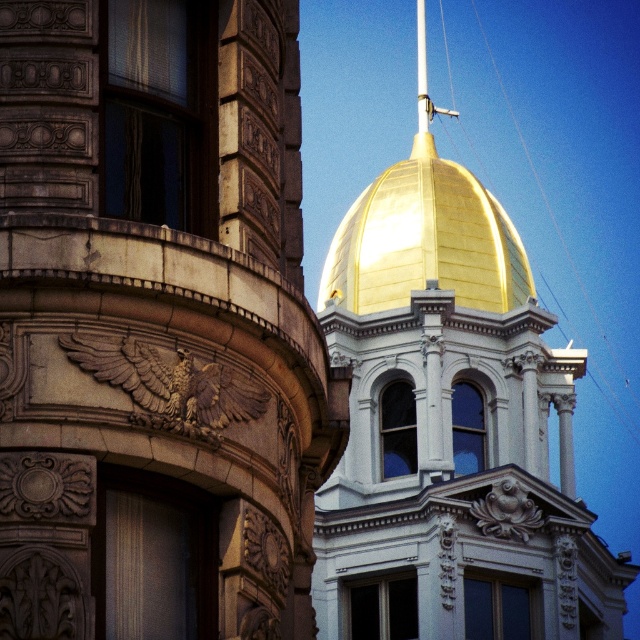
Question: Is gold polished dome at upper center below metallic pole at center?

Choices:
 (A) no
 (B) yes

Answer: (B)

Question: Among these objects, which one is farthest from the camera?

Choices:
 (A) gold polished dome at upper center
 (B) metallic pole at center

Answer: (B)

Question: Which of the following is the closest to the observer?

Choices:
 (A) (422, 6)
 (B) (531, 285)

Answer: (B)

Question: Considering the relative positions of gold polished dome at upper center and metallic pole at center in the image provided, where is gold polished dome at upper center located with respect to metallic pole at center?

Choices:
 (A) above
 (B) below

Answer: (B)

Question: Can you confirm if gold polished dome at upper center is wider than metallic pole at center?

Choices:
 (A) no
 (B) yes

Answer: (B)